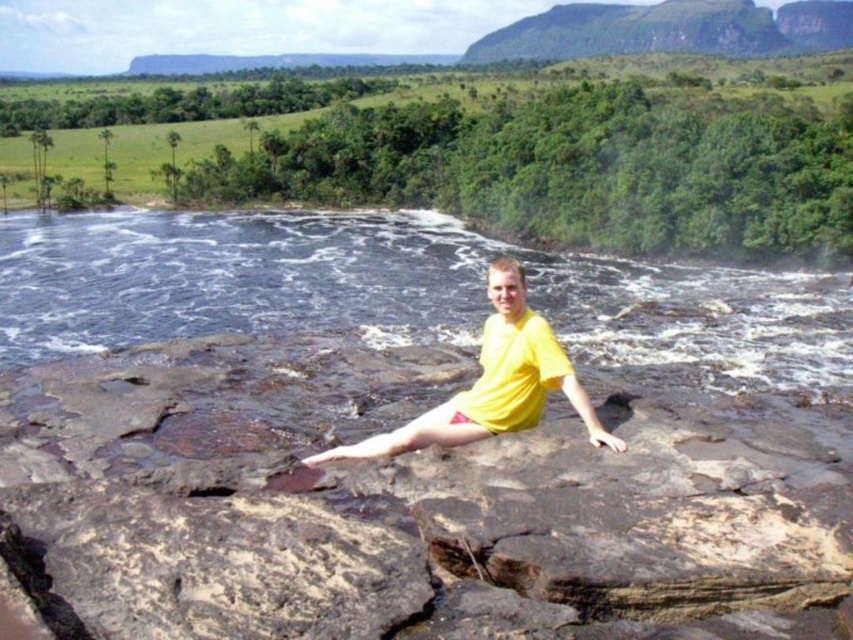
Question: Does black water at center lie in front of yellow matte shirt at center?

Choices:
 (A) yes
 (B) no

Answer: (B)

Question: Does black water at center appear over yellow matte shirt at center?

Choices:
 (A) yes
 (B) no

Answer: (A)

Question: Among these objects, which one is farthest from the camera?

Choices:
 (A) black water at center
 (B) yellow matte shirt at center

Answer: (A)

Question: Among these points, which one is farthest from the camera?

Choices:
 (A) (503, 323)
 (B) (434, 212)

Answer: (B)

Question: Considering the relative positions of black water at center and yellow matte shirt at center in the image provided, where is black water at center located with respect to yellow matte shirt at center?

Choices:
 (A) above
 (B) below

Answer: (A)